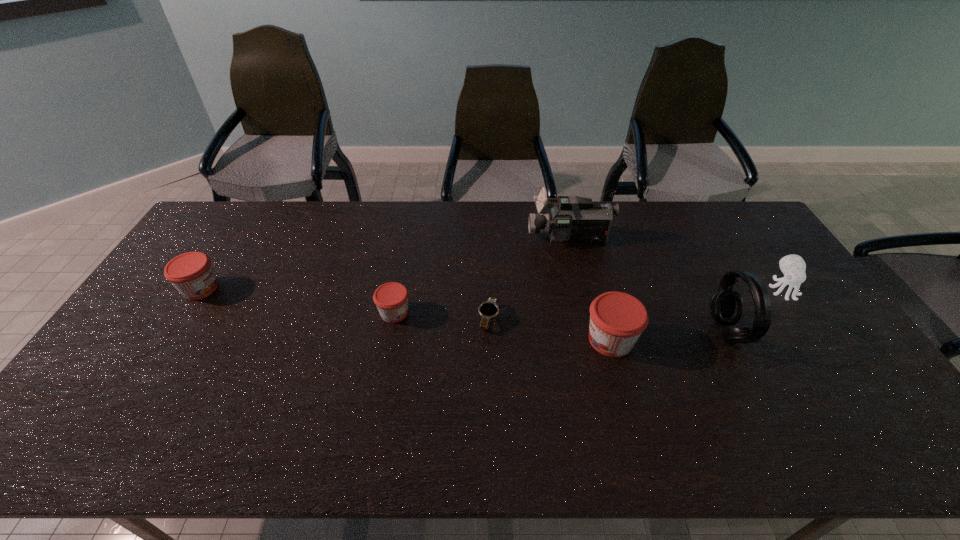
The jams are evenly distributed in the image. To maintain this, where would you place another jam on the right? Please point to a free space. Please provide its 2D coordinates. Your answer should be formatted as a tuple, i.e. [(x, y)], where the tuple contains the x and y coordinates of a point satisfying the conditions above.

[(853, 370)]